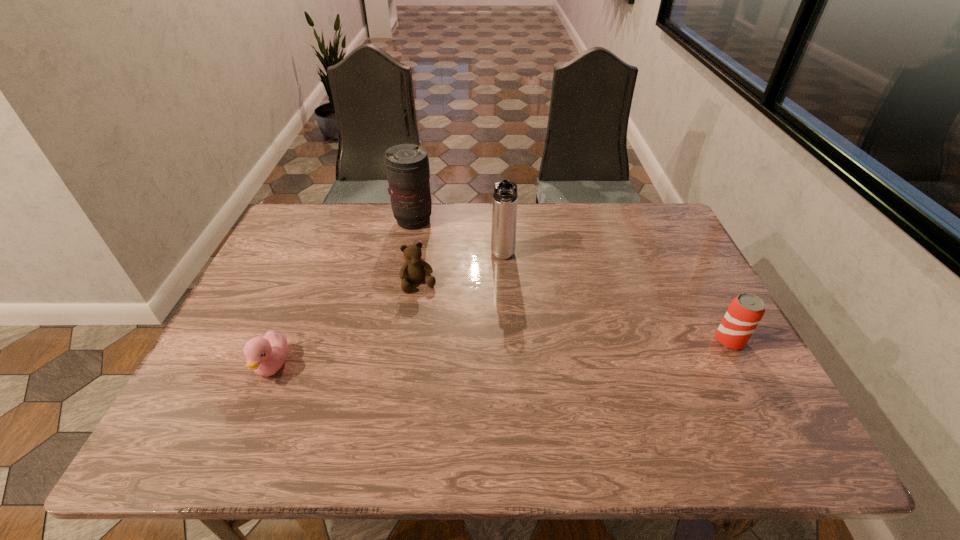
The width and height of the screenshot is (960, 540). I want to click on vacant space on the desktop that is between the duckling and the beer can and is positioned on the handle side of the thermos bottle, so click(506, 353).

The height and width of the screenshot is (540, 960). I want to click on free space on the desktop that is between the duckling and the beer can and is positioned on the side of the telephoto lens where the control switches are located, so click(548, 350).

At what (x,y) coordinates should I click in order to perform the action: click on free spot on the desktop that is between the shortest object and the beer can and is positioned on the front-facing side of the teddy bear. Please return your answer as a coordinate pair (x, y). Looking at the image, I should click on (444, 356).